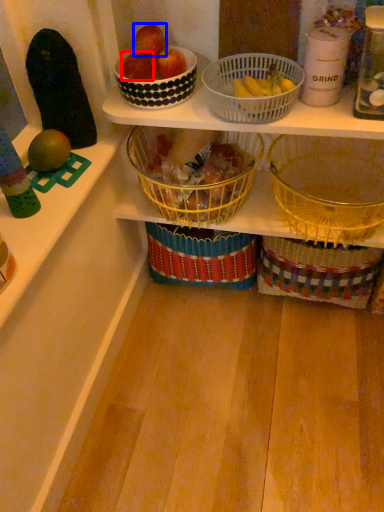
Question: Which of the following is the closest to the observer, apple (highlighted by a red box) or apple (highlighted by a blue box)?

Choices:
 (A) apple
 (B) apple

Answer: (B)